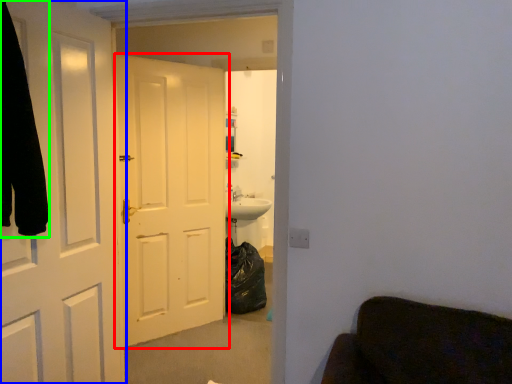
Question: Which object is the farthest from door (highlighted by a red box)? Choose among these: door (highlighted by a blue box) or robe (highlighted by a green box).

Choices:
 (A) door
 (B) robe

Answer: (B)